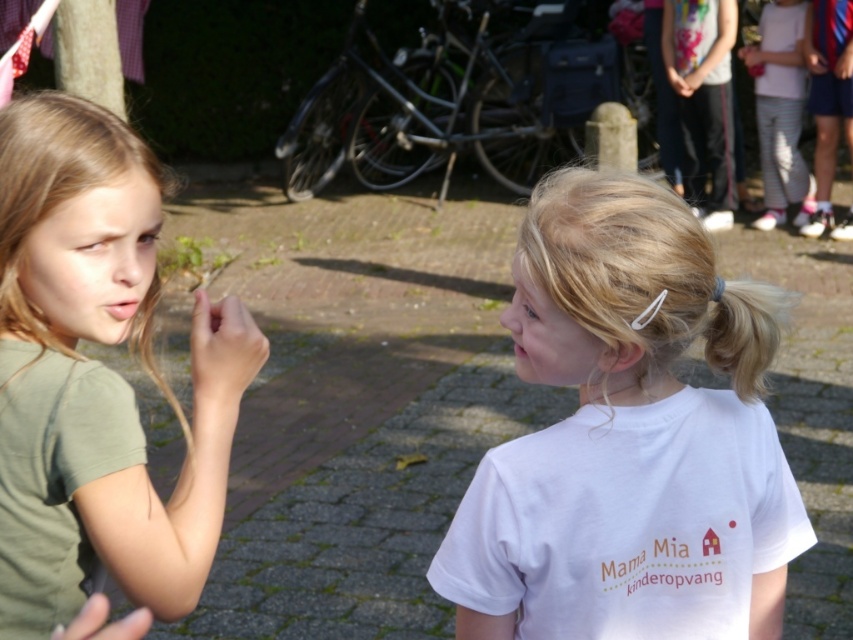
Is white matte t-shirt at center further to camera compared to white striped pants at upper right?

No.

This screenshot has width=853, height=640. What do you see at coordinates (628, 436) in the screenshot?
I see `white matte t-shirt at center` at bounding box center [628, 436].

Where is `white matte t-shirt at center`? This screenshot has height=640, width=853. white matte t-shirt at center is located at coordinates (628, 436).

The width and height of the screenshot is (853, 640). I want to click on white matte t-shirt at center, so click(628, 436).

Is matte green shirt at left thinner than white striped pants at upper right?

Yes, matte green shirt at left is thinner than white striped pants at upper right.

Does point (0, 611) come farther from viewer compared to point (764, 52)?

No, (0, 611) is in front of (764, 52).

Between point (80, 262) and point (761, 214), which one is positioned behind?

The point (761, 214) is more distant.

At what (x,y) coordinates should I click in order to perform the action: click on matte green shirt at left. Please return your answer as a coordinate pair (x, y). This screenshot has width=853, height=640. Looking at the image, I should click on 102,369.

This screenshot has width=853, height=640. What do you see at coordinates (628, 436) in the screenshot?
I see `white matte t-shirt at center` at bounding box center [628, 436].

Describe the element at coordinates (628, 436) in the screenshot. Image resolution: width=853 pixels, height=640 pixels. I see `white matte t-shirt at center` at that location.

Identify the location of white matte t-shirt at center. (628, 436).